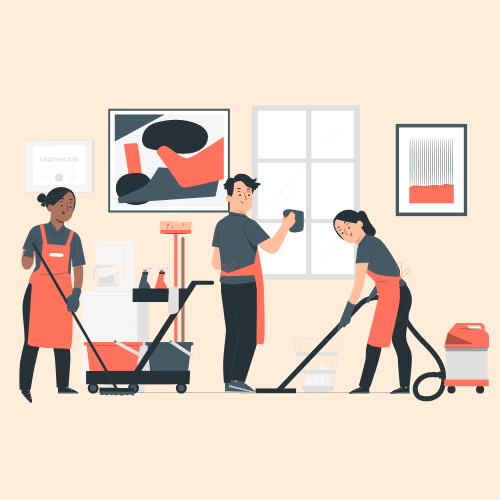
You are a GUI agent. You are given a task and a screenshot of the screen. Output one action in this format:
    pyautogui.click(x=<x>, y=<y>)
    Task: Click on the aprons
    This screenshot has height=500, width=500.
    Given the screenshot: What is the action you would take?
    (260, 276), (388, 302), (46, 307)